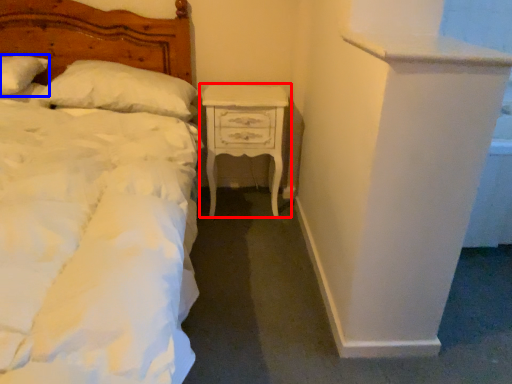
Question: Which object appears closest to the camera in this image, nightstand (highlighted by a red box) or pillow (highlighted by a blue box)?

Choices:
 (A) nightstand
 (B) pillow

Answer: (B)